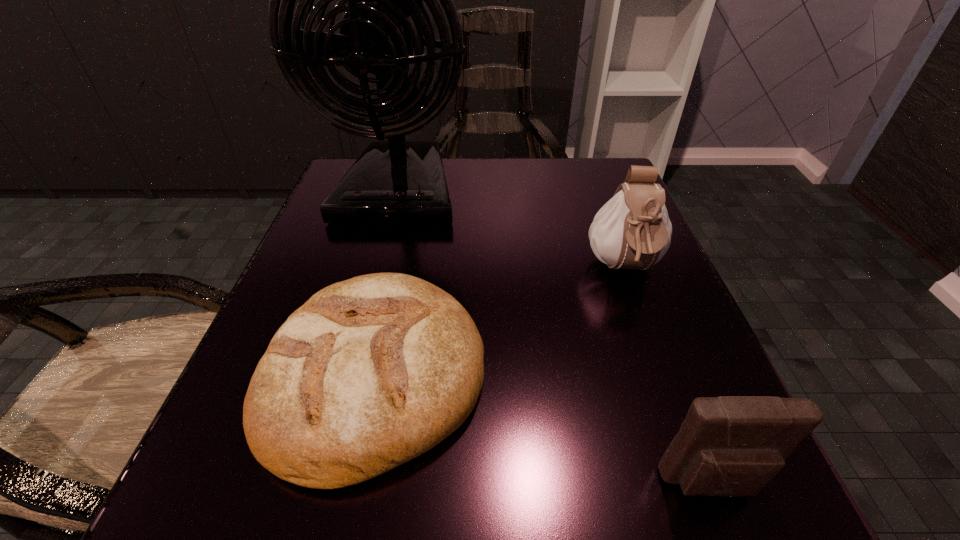
The width and height of the screenshot is (960, 540). I want to click on fan, so click(x=396, y=181).

Locate an element on the screen. Image resolution: width=960 pixels, height=540 pixels. the tallest object is located at coordinates (396, 181).

Identify the location of the taller pouch. The height and width of the screenshot is (540, 960). [632, 230].

Where is `the third shortest object`? The image size is (960, 540). the third shortest object is located at coordinates (632, 230).

Where is `the third tallest object`? the third tallest object is located at coordinates (731, 446).

At what (x,y) coordinates should I click in order to perform the action: click on the shorter pouch. Please return your answer as a coordinate pair (x, y). The height and width of the screenshot is (540, 960). Looking at the image, I should click on (731, 446).

Where is `bread`? The height and width of the screenshot is (540, 960). bread is located at coordinates (371, 372).

Locate an element on the screen. This screenshot has height=540, width=960. free space located in front of the farthest object to blow air is located at coordinates (369, 303).

At what (x,y) coordinates should I click in order to perform the action: click on vacant region located 0.330m on the front-facing side of the farther pouch. Please return your answer as a coordinate pair (x, y). The height and width of the screenshot is (540, 960). Looking at the image, I should click on (718, 524).

At what (x,y) coordinates should I click in order to perform the action: click on vacant space located on the back of the shortest object. Please return your answer as a coordinate pair (x, y). Looking at the image, I should click on (416, 181).